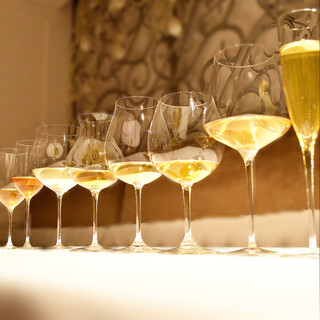
Where is `wine glasses`? The height and width of the screenshot is (320, 320). wine glasses is located at coordinates click(x=304, y=85), click(x=245, y=98), click(x=184, y=131), click(x=137, y=132), click(x=93, y=142), click(x=58, y=150), click(x=25, y=162), click(x=8, y=172).